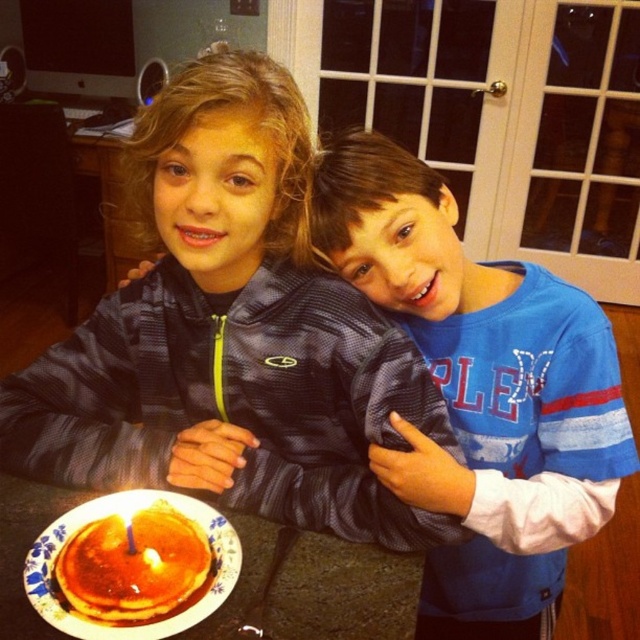
Consider the image. Is the position of blue jersey at center less distant than that of yellow wax candle at lower left?

Yes.

Is blue jersey at center further to the viewer compared to yellow wax candle at lower left?

No.

Locate an element on the screen. blue jersey at center is located at coordinates (481, 392).

Can you confirm if blue fabric jacket at center is positioned to the left of golden syrup pancake at lower left?

Incorrect, blue fabric jacket at center is not on the left side of golden syrup pancake at lower left.

Can you confirm if blue fabric jacket at center is bigger than golden syrup pancake at lower left?

Yes.

Between point (323, 435) and point (72, 589), which one is positioned in front?

Point (72, 589) is more forward.

Find the location of a particular element. Image resolution: width=640 pixels, height=640 pixels. blue fabric jacket at center is located at coordinates (230, 337).

Does white wax candle at lower left have a lesser width compared to yellow wax candle at lower left?

No, white wax candle at lower left is not thinner than yellow wax candle at lower left.

Is point (132, 552) positioned in front of point (124, 518)?

Yes.

This screenshot has height=640, width=640. What are the coordinates of `white wax candle at lower left` in the screenshot? It's located at (129, 529).